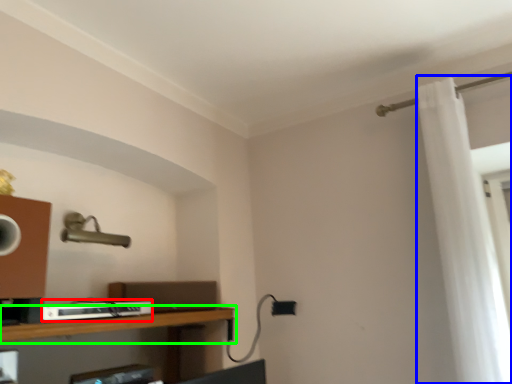
Question: Which object is the farthest from equipment (highlighted by a red box)? Choose among these: shower curtain (highlighted by a blue box) or shelf (highlighted by a green box).

Choices:
 (A) shower curtain
 (B) shelf

Answer: (A)